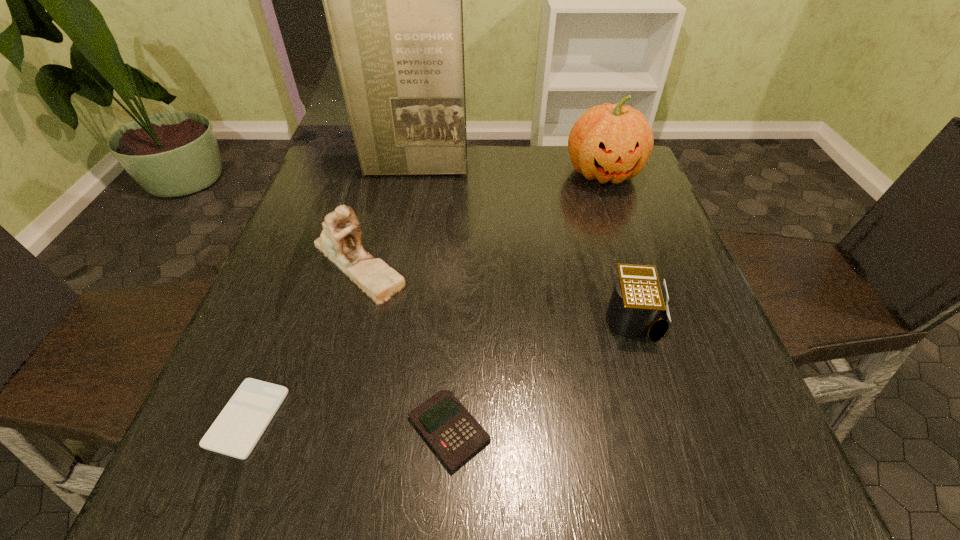
Where is `pumpkin that is positioned at the right edge`? This screenshot has width=960, height=540. pumpkin that is positioned at the right edge is located at coordinates (608, 142).

The width and height of the screenshot is (960, 540). I want to click on calculator located at the right edge, so click(638, 306).

Find the location of a particular element. object at the far left corner is located at coordinates (393, 3).

Where is `object that is at the near left corner`? object that is at the near left corner is located at coordinates (235, 432).

I want to click on object that is at the far right corner, so click(608, 142).

Where is `blank space at the far edge of the desktop`? blank space at the far edge of the desktop is located at coordinates (499, 170).

The image size is (960, 540). I want to click on vacant space at the left edge of the desktop, so click(309, 289).

Find the location of a particular element. free space at the right edge of the desktop is located at coordinates pyautogui.click(x=697, y=306).

In the image, there is a desktop. Where is `free space at the far left corner`? The width and height of the screenshot is (960, 540). free space at the far left corner is located at coordinates (330, 167).

In the image, there is a desktop. Where is `vacant space at the far right corner`? This screenshot has width=960, height=540. vacant space at the far right corner is located at coordinates (616, 191).